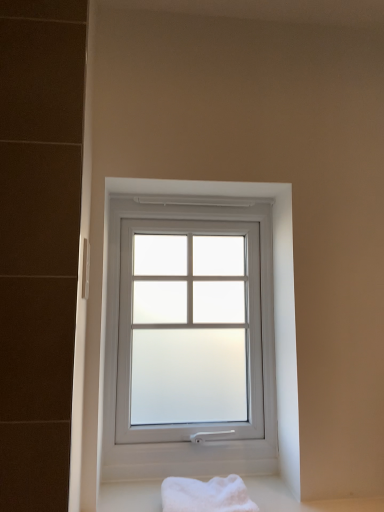
At what (x,y) coordinates should I click in order to perform the action: click on white soft bath towel at lower center. Please return your answer as a coordinate pair (x, y). This screenshot has width=384, height=512. Looking at the image, I should click on (206, 495).

The image size is (384, 512). Describe the element at coordinates (206, 495) in the screenshot. I see `white soft bath towel at lower center` at that location.

This screenshot has width=384, height=512. What do you see at coordinates (262, 286) in the screenshot? I see `white frosted glass window at center` at bounding box center [262, 286].

The height and width of the screenshot is (512, 384). Identify the location of white frosted glass window at center. (262, 286).

Find the location of a particular element. The width and height of the screenshot is (384, 512). white soft bath towel at lower center is located at coordinates pyautogui.click(x=206, y=495).

Does white frosted glass window at center appear on the right side of white soft bath towel at lower center?

Incorrect, white frosted glass window at center is not on the right side of white soft bath towel at lower center.

Does white frosted glass window at center lie in front of white soft bath towel at lower center?

No, the depth of white frosted glass window at center is greater than that of white soft bath towel at lower center.

Considering the positions of points (240, 190) and (216, 494), is point (240, 190) farther from camera compared to point (216, 494)?

Yes.

From the picture: From the image's perspective, which is above, white frosted glass window at center or white soft bath towel at lower center?

white frosted glass window at center is shown above in the image.

From a real-world perspective, is white frosted glass window at center over white soft bath towel at lower center?

Yes, from a real-world perspective, white frosted glass window at center is above white soft bath towel at lower center.

Which of these two, white frosted glass window at center or white soft bath towel at lower center, is wider?

white soft bath towel at lower center.

Can you confirm if white frosted glass window at center is shorter than white soft bath towel at lower center?

No, white frosted glass window at center is not shorter than white soft bath towel at lower center.

Is white frosted glass window at center bigger than white soft bath towel at lower center?

Correct, white frosted glass window at center is larger in size than white soft bath towel at lower center.

Would you say white soft bath towel at lower center is part of white frosted glass window at center's contents?

Actually, white soft bath towel at lower center is outside white frosted glass window at center.

Are white frosted glass window at center and white soft bath towel at lower center beside each other?

No, white frosted glass window at center is not touching white soft bath towel at lower center.

Is white soft bath towel at lower center at the back of white frosted glass window at center?

No, white soft bath towel at lower center is not at the back of white frosted glass window at center.

From the picture: How different are the orientations of white frosted glass window at center and white soft bath towel at lower center in degrees?

white frosted glass window at center and white soft bath towel at lower center are facing 0.845 degrees away from each other.

In order to click on window behind the white soft bath towel at lower center in this screenshot , I will do pyautogui.click(x=262, y=286).

Which is more to the left, white soft bath towel at lower center or white frosted glass window at center?

white frosted glass window at center is more to the left.

Is white soft bath towel at lower center in front of white frosted glass window at center?

Yes, white soft bath towel at lower center is in front of white frosted glass window at center.

Does point (172, 490) come farther from viewer compared to point (106, 317)?

No, (172, 490) is in front of (106, 317).

From the image's perspective, which object appears higher, white soft bath towel at lower center or white frosted glass window at center?

white frosted glass window at center is shown above in the image.

From a real-world perspective, is white soft bath towel at lower center below white frosted glass window at center?

Yes, from a real-world perspective, white soft bath towel at lower center is under white frosted glass window at center.

Consider the image. Considering the relative sizes of white soft bath towel at lower center and white frosted glass window at center in the image provided, is white soft bath towel at lower center wider than white frosted glass window at center?

Correct, the width of white soft bath towel at lower center exceeds that of white frosted glass window at center.

Considering the sizes of objects white soft bath towel at lower center and white frosted glass window at center in the image provided, who is shorter, white soft bath towel at lower center or white frosted glass window at center?

white soft bath towel at lower center.

Between white soft bath towel at lower center and white frosted glass window at center, which one has smaller size?

white soft bath towel at lower center.

Is white soft bath towel at lower center spatially inside white frosted glass window at center, or outside of it?

white soft bath towel at lower center exists outside the volume of white frosted glass window at center.

Is white soft bath towel at lower center next to white frosted glass window at center and touching it?

No, white soft bath towel at lower center is not in contact with white frosted glass window at center.

Is white soft bath towel at lower center aimed at white frosted glass window at center?

No, white soft bath towel at lower center does not turn towards white frosted glass window at center.

How different are the orientations of white soft bath towel at lower center and white frosted glass window at center in degrees?

There is a 0.845-degree angle between the facing directions of white soft bath towel at lower center and white frosted glass window at center.

Measure the distance between white soft bath towel at lower center and white frosted glass window at center.

17.13 inches.

Find the location of a particular element. bath towel located underneath the white frosted glass window at center (from a real-world perspective) is located at coordinates (206, 495).

You are a GUI agent. You are given a task and a screenshot of the screen. Output one action in this format:
    pyautogui.click(x=<x>, y=<y>)
    Task: Click on the bath towel below the white frosted glass window at center (from the image's perspective)
    This screenshot has height=512, width=384.
    Given the screenshot: What is the action you would take?
    pyautogui.click(x=206, y=495)

Identify the location of bath towel on the right side of white frosted glass window at center. The image size is (384, 512). (206, 495).